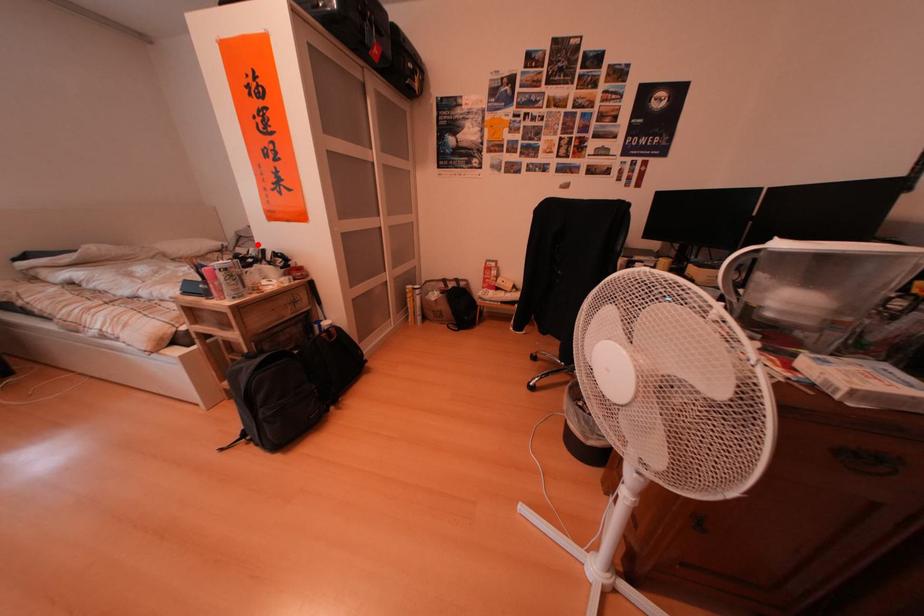
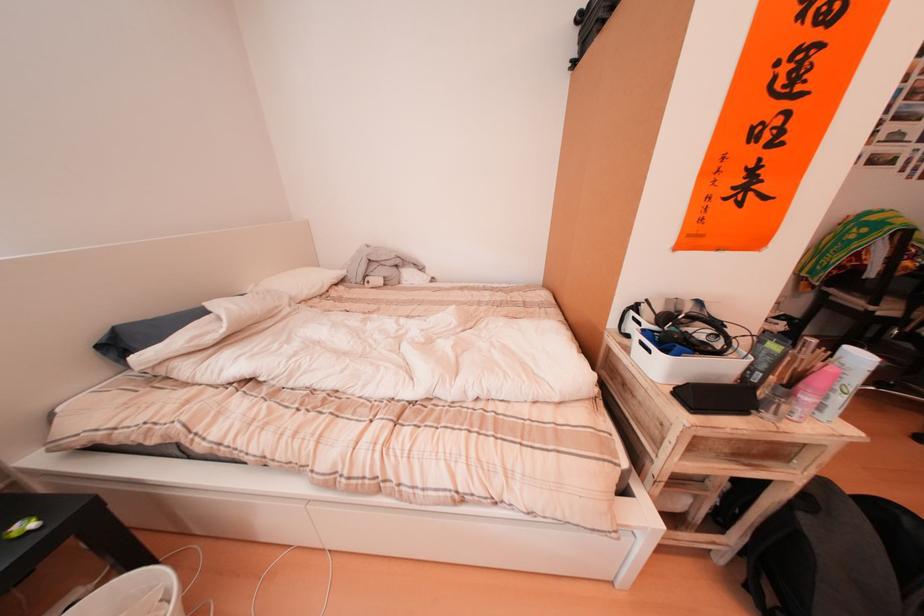
Question: I am providing you with two images of the same scene from different viewpoints. Image1 has a red point marked. In image2, the corresponding 3D location appears at what relative position? Reply with the corresponding letter.

Choices:
 (A) Closer
 (B) Farther

Answer: (A)